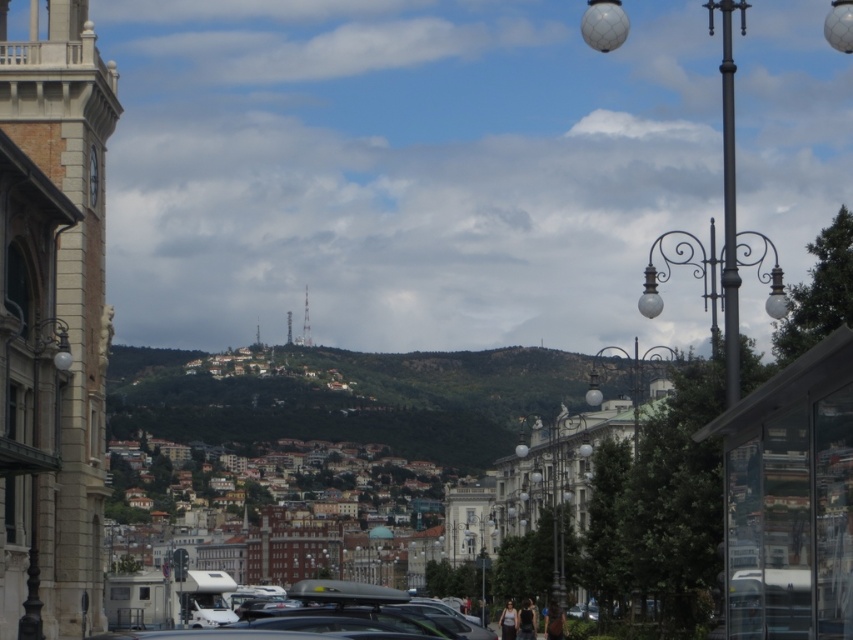
Is light beige stone bell tower at left thinner than white metallic tower at center?

No.

Can you confirm if light beige stone bell tower at left is positioned below white metallic tower at center?

Indeed, light beige stone bell tower at left is positioned under white metallic tower at center.

Is point (15, 157) positioned before point (305, 310)?

Yes, it is.

You are a GUI agent. You are given a task and a screenshot of the screen. Output one action in this format:
    pyautogui.click(x=<x>, y=<y>)
    Task: Click on the light beige stone bell tower at left
    The image size is (853, 640).
    Given the screenshot: What is the action you would take?
    pyautogui.click(x=51, y=321)

Can you confirm if light beige stone bell tower at left is positioned above metallic silver bell tower at center?

No.

Who is more forward, (82, 93) or (288, 330)?

Positioned in front is point (82, 93).

Identify the location of light beige stone bell tower at left. (51, 321).

Identify the location of light beige stone bell tower at left. This screenshot has width=853, height=640. (51, 321).

Is white glass lamp post at right bigger than metallic silver bell tower at center?

Yes, white glass lamp post at right is bigger than metallic silver bell tower at center.

Based on the photo, is white glass lamp post at right to the right of metallic silver bell tower at center from the viewer's perspective?

Correct, you'll find white glass lamp post at right to the right of metallic silver bell tower at center.

Which is behind, point (614, 493) or point (287, 314)?

The point (287, 314) is more distant.

Find the location of a particular element. This screenshot has width=853, height=640. white glass lamp post at right is located at coordinates (619, 472).